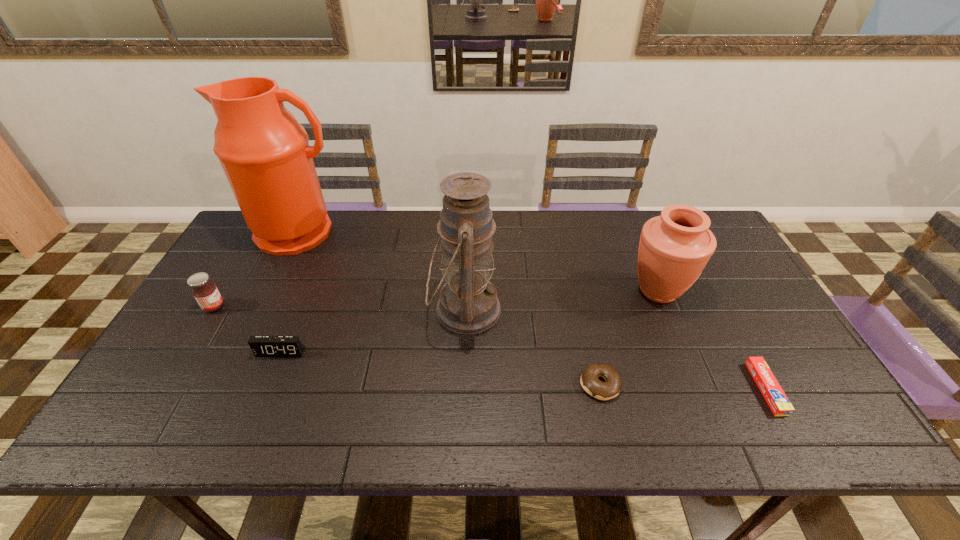
What are the coordinates of `free space between the third object from right to left and the sixth shortest object` in the screenshot? It's located at click(532, 347).

I want to click on free space between the shortest object and the doughnut, so click(x=683, y=387).

I want to click on free spot between the third shortest object and the second shortest object, so click(x=440, y=368).

Where is `free space between the fourth tallest object and the toothpaste`? free space between the fourth tallest object and the toothpaste is located at coordinates (490, 347).

At what (x,y) coordinates should I click in order to perform the action: click on free space between the rightmost object and the fifth object from left to right. Please return your answer as a coordinate pair (x, y). The height and width of the screenshot is (540, 960). Looking at the image, I should click on (683, 387).

Where is `object that stands as the fourth closest to the vase`? The image size is (960, 540). object that stands as the fourth closest to the vase is located at coordinates (264, 152).

At what (x,y) coordinates should I click in order to perform the action: click on object that ranks as the fifth closest to the vase. Please return your answer as a coordinate pair (x, y). This screenshot has height=540, width=960. Looking at the image, I should click on (262, 346).

At what (x,y) coordinates should I click in order to perform the action: click on free region that satisfies the following two spatial constraints: 1. on the label side of the jam; 2. on the right side of the rightmost object. Please return your answer as a coordinate pair (x, y). The width and height of the screenshot is (960, 540). Looking at the image, I should click on (165, 388).